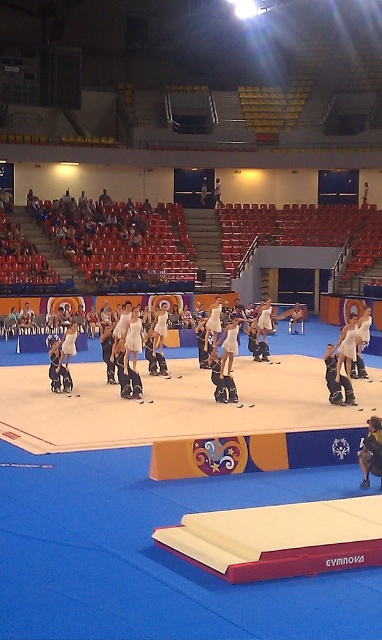
Question: Can you confirm if matte black gymnastics suit at center is positioned below matte black gymnast at center?

Choices:
 (A) yes
 (B) no

Answer: (B)

Question: Is the position of dark blue fabric at center less distant than that of matte black gymnastics suit at center?

Choices:
 (A) yes
 (B) no

Answer: (A)

Question: Which point appears closest to the camera in this image?

Choices:
 (A) (220, 204)
 (B) (357, 456)
 (C) (61, 388)

Answer: (B)

Question: Estimate the real-world distances between objects in this image. Which object is farther from the dark blue fabric at center?

Choices:
 (A) matte black gymnastics suit at center
 (B) white matte gymnastics outfit at center
 (C) matte black gymnast at center

Answer: (C)

Question: Is the position of matte black gymnast at center less distant than that of white fabric gymnast at center?

Choices:
 (A) yes
 (B) no

Answer: (A)

Question: Which object is positioned farthest from the matte black gymnast at center?

Choices:
 (A) matte black gymnastics suit at center
 (B) white matte gymnastics outfit at center
 (C) dark blue fabric at center
 (D) white fabric gymnast at center

Answer: (D)